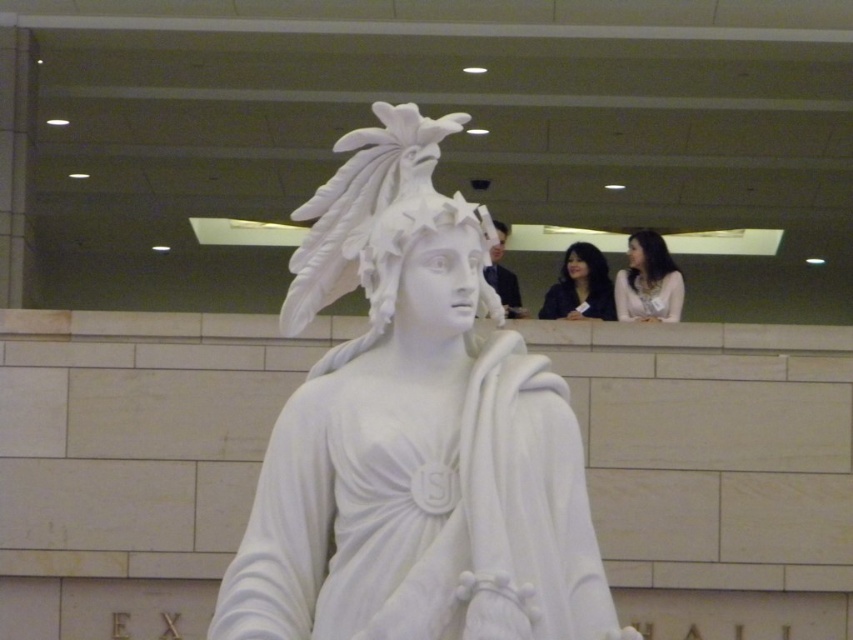
From the picture: You are an interior designer assessing the layout of this space. You need to place a new decorative item that must be placed to the right of the dark blue fabric at upper center. Can the white marble statue at center be moved to accommodate this requirement?

The white marble statue at center is already positioned to the left of the dark blue fabric at upper center. To place a new item to the right of the dark blue fabric at upper center, the statue would need to remain where it is, as moving it might interfere with the existing layout. The new item can be placed to the right of the dark blue fabric at upper center without moving the statue.

You are an interior designer assessing the space for a new sculpture. You notice the white marble statue at center and the smooth white blouse at upper right. Based on their sizes, which object would require more vertical space in the room?

The white marble statue at center is taller than the smooth white blouse at upper right, so it would require more vertical space in the room.